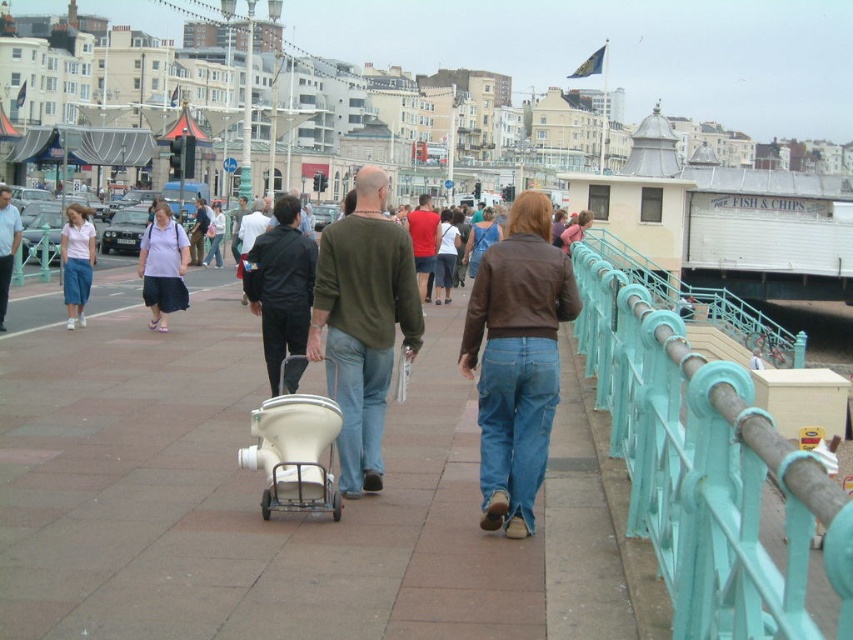
Question: Can you confirm if matte purple blouse at center is thinner than dark brown leather jacket at center?

Choices:
 (A) no
 (B) yes

Answer: (B)

Question: Does black matte jacket at center have a lesser width compared to matte purple blouse at center?

Choices:
 (A) no
 (B) yes

Answer: (A)

Question: Can you confirm if teal painted metal railing at right is positioned to the right of white plastic baby carriage at center?

Choices:
 (A) yes
 (B) no

Answer: (A)

Question: Which object appears closest to the camera in this image?

Choices:
 (A) teal painted metal railing at right
 (B) dark brown leather jacket at center
 (C) matte white skirt at left
 (D) matte black shirt at center

Answer: (A)

Question: Among these objects, which one is farthest from the camera?

Choices:
 (A) teal painted metal railing at right
 (B) white plastic baby carriage at center
 (C) matte white skirt at left

Answer: (C)

Question: Which object is positioned closest to the teal painted metal railing at right?

Choices:
 (A) dark brown leather jacket at center
 (B) matte white skirt at left
 (C) black matte jacket at center
 (D) brown leather jacket at center

Answer: (D)